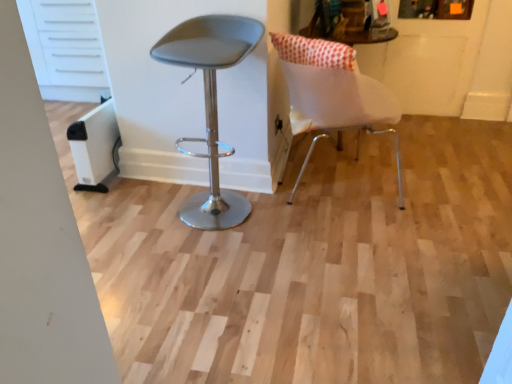
Identify the location of free location in front of matte gray stool at center, which is the first chair in left-to-right order. This screenshot has width=512, height=384. (191, 258).